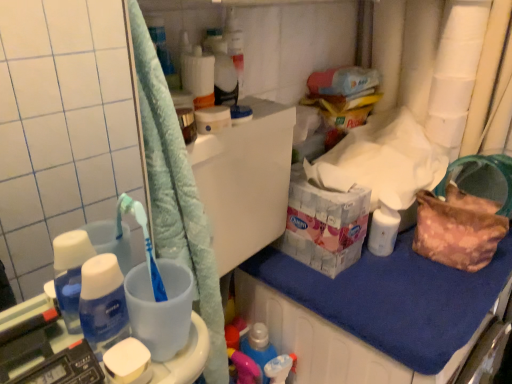
Question: From a real-world perspective, is black plastic scale at lower left positioned over white matte toilet paper at upper right based on gravity?

Choices:
 (A) no
 (B) yes

Answer: (A)

Question: Is black plastic scale at lower left at the right side of white matte toilet paper at upper right?

Choices:
 (A) yes
 (B) no

Answer: (B)

Question: Is black plastic scale at lower left positioned behind white matte toilet paper at upper right?

Choices:
 (A) yes
 (B) no

Answer: (B)

Question: Is black plastic scale at lower left far from white matte toilet paper at upper right?

Choices:
 (A) no
 (B) yes

Answer: (B)

Question: Is black plastic scale at lower left taller than white matte toilet paper at upper right?

Choices:
 (A) yes
 (B) no

Answer: (B)

Question: From the image's perspective, is blue fabric at lower right above or below white matte soap at lower left?

Choices:
 (A) below
 (B) above

Answer: (B)

Question: In terms of height, does blue fabric at lower right look taller or shorter compared to white matte soap at lower left?

Choices:
 (A) short
 (B) tall

Answer: (B)

Question: Is blue fabric at lower right wider or thinner than white matte soap at lower left?

Choices:
 (A) wide
 (B) thin

Answer: (A)

Question: Is blue fabric at lower right inside or outside of white matte soap at lower left?

Choices:
 (A) outside
 (B) inside

Answer: (A)

Question: Considering their positions, is blue fabric at lower right located in front of or behind white matte toilet paper at upper right?

Choices:
 (A) front
 (B) behind

Answer: (A)

Question: Is blue fabric at lower right spatially inside white matte toilet paper at upper right, or outside of it?

Choices:
 (A) outside
 (B) inside

Answer: (A)

Question: Is blue fabric at lower right taller or shorter than white matte toilet paper at upper right?

Choices:
 (A) tall
 (B) short

Answer: (B)

Question: In terms of size, does blue fabric at lower right appear bigger or smaller than white matte toilet paper at upper right?

Choices:
 (A) small
 (B) big

Answer: (B)

Question: From a real-world perspective, is black plastic scale at lower left physically located above or below blue fabric at lower right?

Choices:
 (A) below
 (B) above

Answer: (B)

Question: Visually, is black plastic scale at lower left positioned to the left or to the right of blue fabric at lower right?

Choices:
 (A) right
 (B) left

Answer: (B)